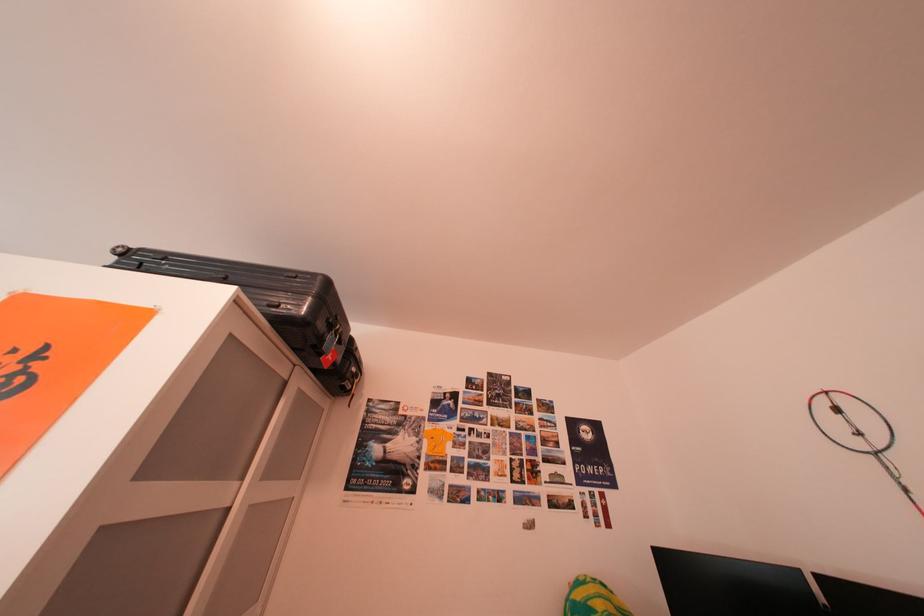
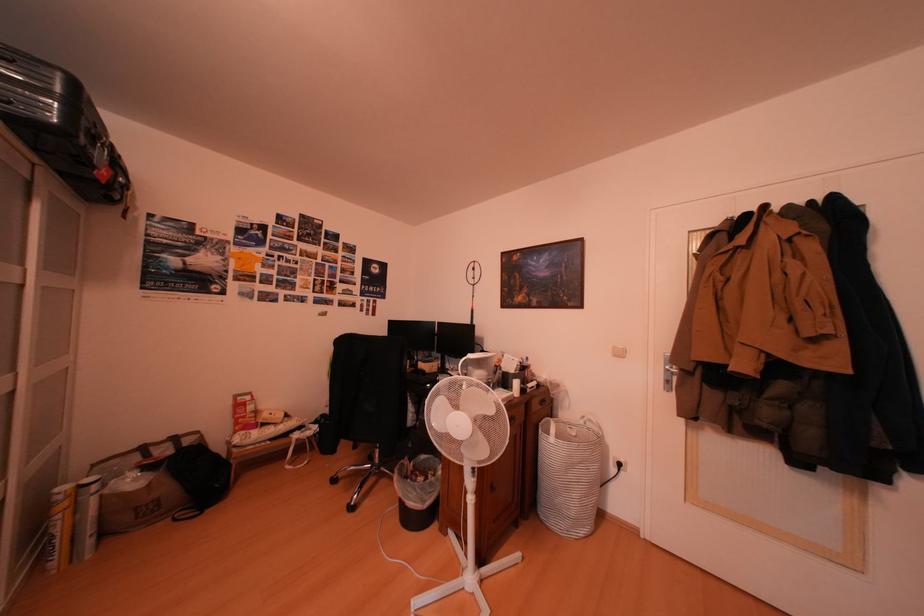
The images are taken continuously from a first-person perspective. In which direction is your viewpoint rotating?

The camera's rotation is toward right-down.